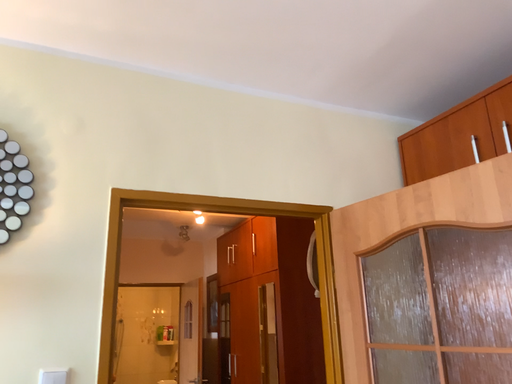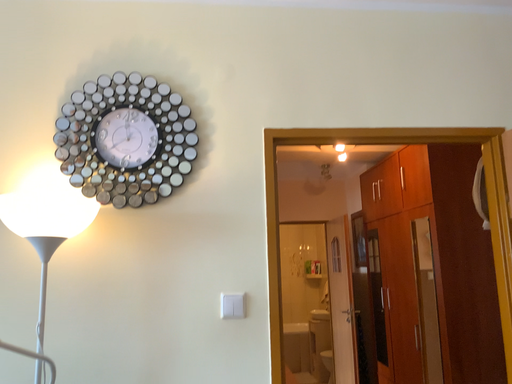
Question: How did the camera likely rotate when shooting the video?

Choices:
 (A) rotated downward
 (B) rotated upward

Answer: (A)